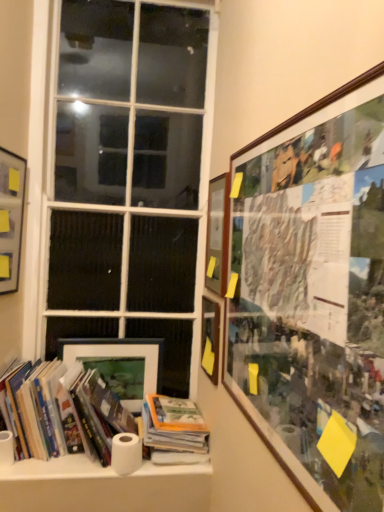
This screenshot has height=512, width=384. I want to click on free space to the left of white matte toilet paper at lower center, so click(84, 465).